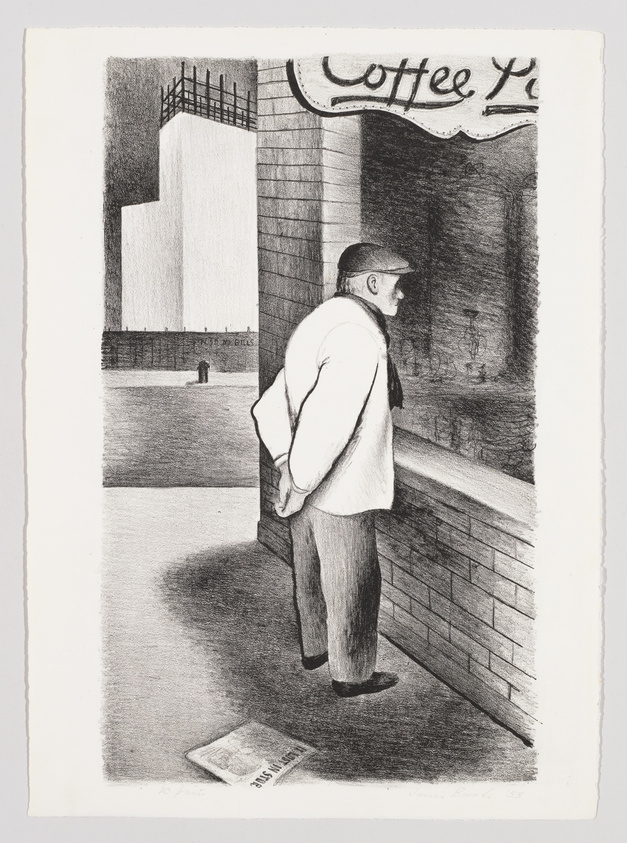
The width and height of the screenshot is (627, 843). I want to click on bottom window sil, so click(x=436, y=464).